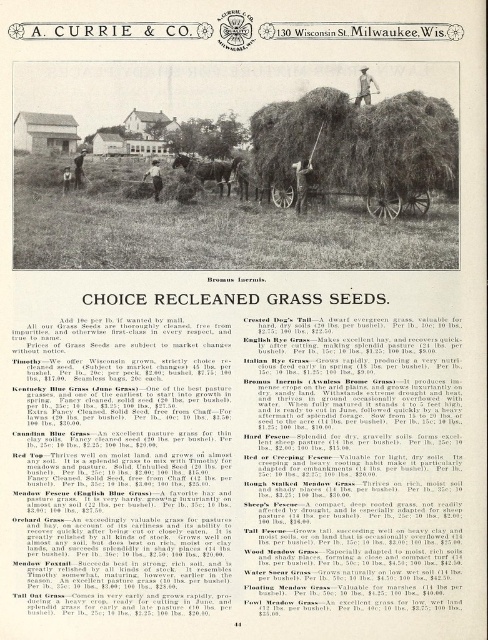
You are a farmer who wants to load more hay onto the brown wooden wagon at center and the dark brown horse at center. Which object has more space available for adding hay?

The brown wooden wagon at center has more space available for adding hay because it is thinner than the dark brown horse at center, implying it can accommodate more material without compromising structural integrity.

Based on the vintage advertisement scene described, where is the wooden cart at center positioned in the image?

The wooden cart at center is positioned at the point (395, 202) in the image.

You are a farmer looking at this advertisement and notice the green grass at center and the dark brown horse at center. Which object is positioned lower in the image?

The green grass at center is positioned lower than the dark brown horse at center in the image.